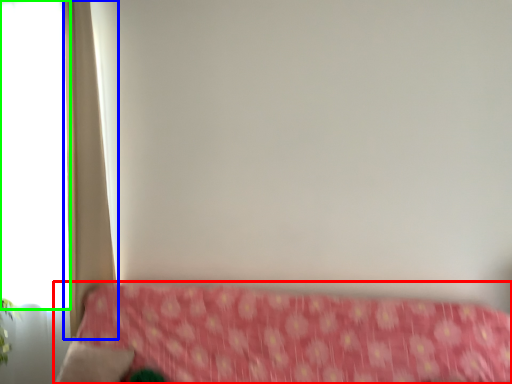
Question: Which object is positioned closest to furniture (highlighted by a red box)? Select from curtain (highlighted by a blue box) and window (highlighted by a green box).

Choices:
 (A) curtain
 (B) window

Answer: (A)